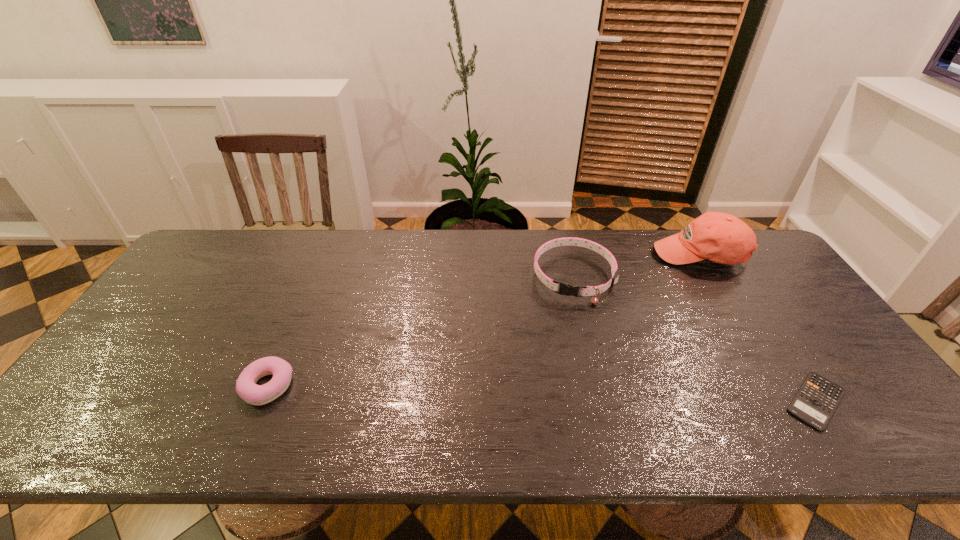
Where is `blank region between the tallest object and the second object from left to right`? blank region between the tallest object and the second object from left to right is located at coordinates (636, 267).

The height and width of the screenshot is (540, 960). What are the coordinates of `free space that is in between the pastry and the tallest object` in the screenshot? It's located at (484, 321).

You are a GUI agent. You are given a task and a screenshot of the screen. Output one action in this format:
    pyautogui.click(x=<x>, y=<y>)
    Task: Click on the free point between the baseball cap and the second tallest object
    The image size is (960, 540).
    Given the screenshot: What is the action you would take?
    pos(636,267)

Locate an element on the screen. Image resolution: width=960 pixels, height=540 pixels. free point between the second shortest object and the third object from right to left is located at coordinates (420, 332).

The width and height of the screenshot is (960, 540). I want to click on free space that is in between the calculator and the second tallest object, so click(x=695, y=339).

Identify the location of unoccupied area between the leftmost object and the shortest object. Image resolution: width=960 pixels, height=540 pixels. (541, 393).

Where is `vacant space in between the dog collar and the calculator`? This screenshot has height=540, width=960. vacant space in between the dog collar and the calculator is located at coordinates (695, 339).

Locate an element on the screen. empty space that is in between the calculator and the tallest object is located at coordinates (757, 328).

Locate which object is the third closest to the shortest object. Please provide its 2D coordinates. Your answer should be formatted as a tuple, i.e. [(x, y)], where the tuple contains the x and y coordinates of a point satisfying the conditions above.

[(246, 387)]

Identify which object is located as the third nearest to the third tallest object. Please provide its 2D coordinates. Your answer should be formatted as a tuple, i.e. [(x, y)], where the tuple contains the x and y coordinates of a point satisfying the conditions above.

[(817, 399)]